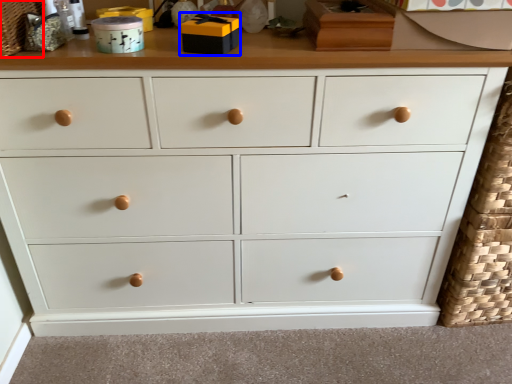
Question: Which point is further to the camera, basket (highlighted by a red box) or toy (highlighted by a blue box)?

Choices:
 (A) basket
 (B) toy

Answer: (B)